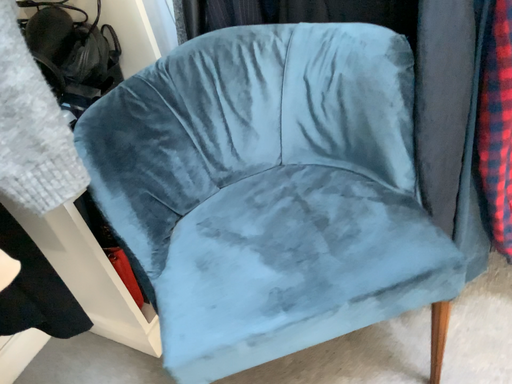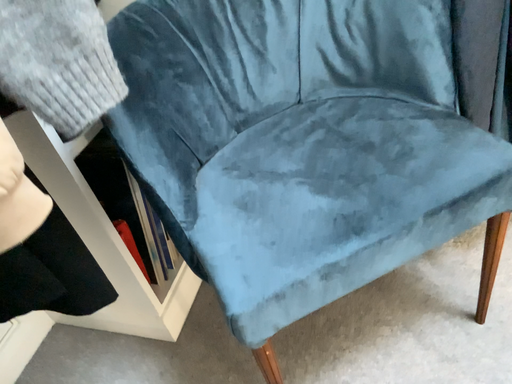
Question: How did the camera likely rotate when shooting the video?

Choices:
 (A) rotated left
 (B) rotated right

Answer: (B)